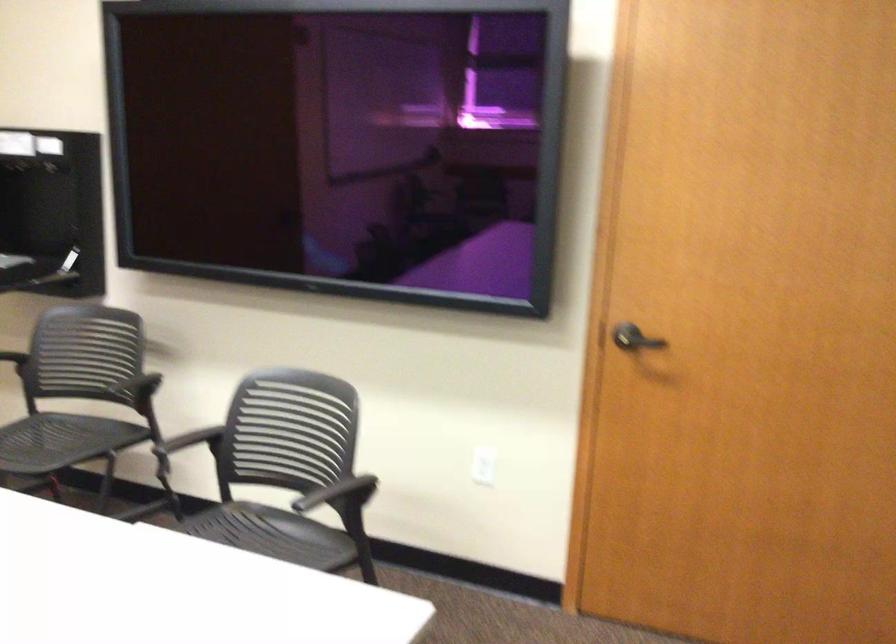
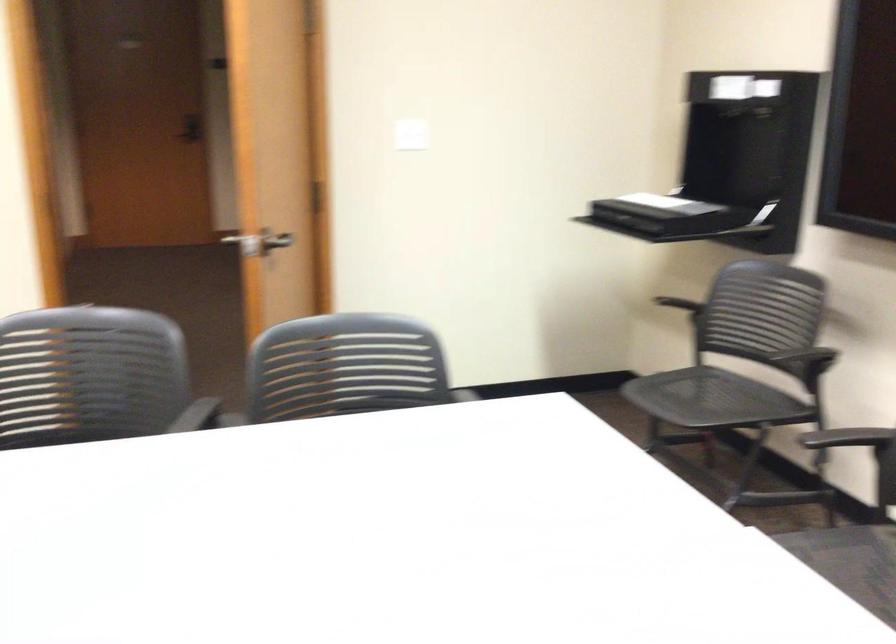
Question: The camera is either moving clockwise (left) or counter-clockwise (right) around the object. The first image is from the beginning of the video and the second image is from the end. Is the camera moving left or right when shooting the video?

Choices:
 (A) Left
 (B) Right

Answer: (B)